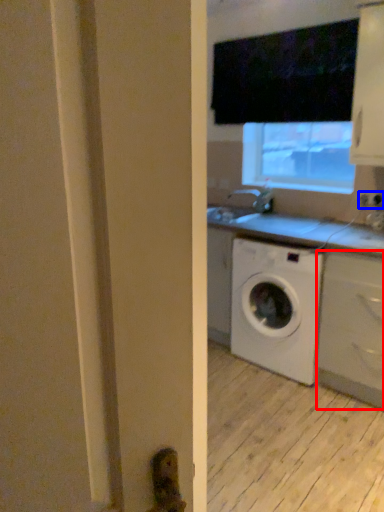
Question: Which object is closer to the camera taking this photo, cabinetry (highlighted by a red box) or electric outlet (highlighted by a blue box)?

Choices:
 (A) cabinetry
 (B) electric outlet

Answer: (A)